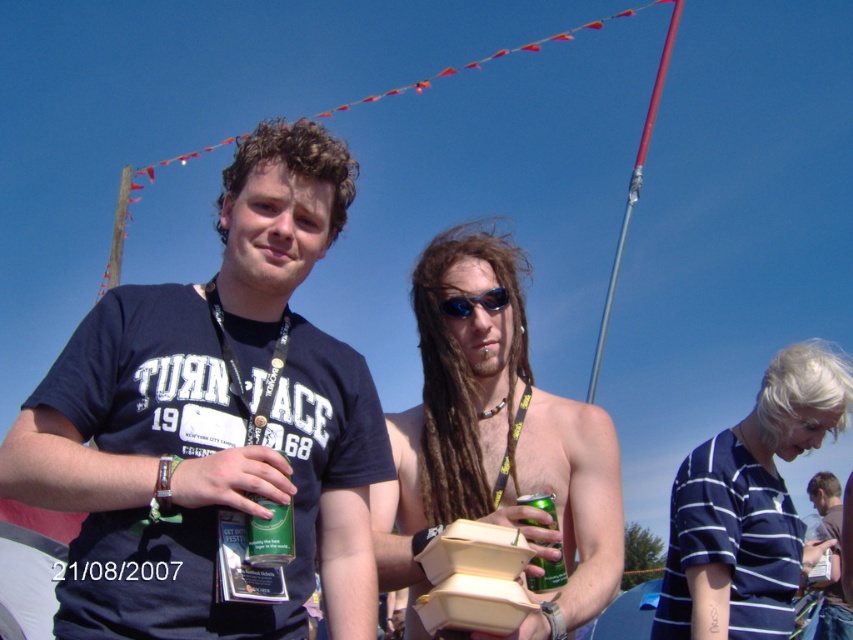
You are standing in the scene and want to hand a gray fabric shirt at center to someone behind you. Can you reach it without moving closer?

The gray fabric shirt at center is 52.78 meters from viewer, so you cannot reach it without moving closer.

You are standing in the scene and see the point at coordinates [831,557]. Which object in the scene does this point lie on?

The point at coordinates [831,557] lies on the gray fabric shirt at center.

Please describe the position of the shiny silver can at center in terms of its coordinates in the image. The image has a coordinate system where the bottom left corner is the origin point. The x and y axes increase to the right and up respectively. The coordinates are normalized between 0 and 1. You must use the exact object label from the Objects section in your answer. The question must be phrased in a way that requires the answer to include the coordinates provided in the Objects Description. The answer,

The shiny silver can at center is located at coordinates x 0.694 and y 0.583 in the image.